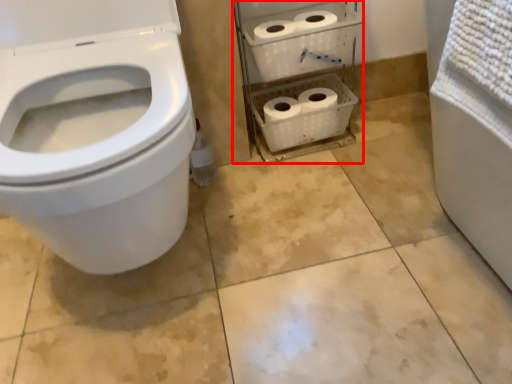
Question: Where is shelf (annotated by the red box) located in relation to toilet in the image?

Choices:
 (A) right
 (B) left

Answer: (A)